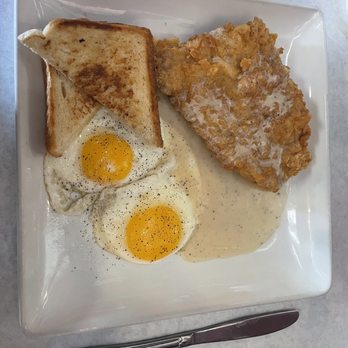
I want to click on gray countertop, so click(x=5, y=165), click(x=340, y=141), click(x=334, y=5), click(x=316, y=331).